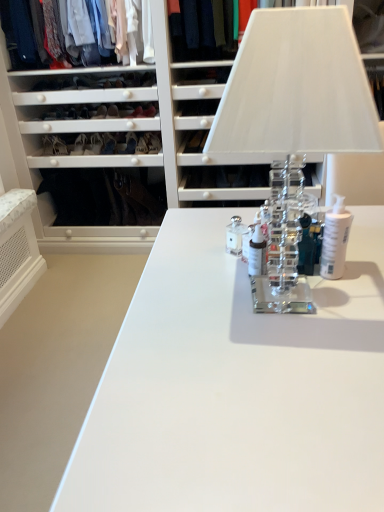
Question: Looking at the image, does matte black shoe at lower left, arranged as the third shoe when viewed from the right, seem bigger or smaller compared to matte white shirts at upper left, acting as the 2th clothing starting from the right?

Choices:
 (A) small
 (B) big

Answer: (A)

Question: Considering the positions of matte black shoe at lower left, arranged as the third shoe when viewed from the right, and matte white shirts at upper left, acting as the 2th clothing starting from the right, in the image, is matte black shoe at lower left, arranged as the third shoe when viewed from the right, wider or thinner than matte white shirts at upper left, acting as the 2th clothing starting from the right,?

Choices:
 (A) thin
 (B) wide

Answer: (A)

Question: Which is farther from the clear glass table lamp at center?

Choices:
 (A) white plastic pump bottle at center, the 3th toiletry from the left
 (B) matte white shirts at upper left, the 1th clothing viewed from the left
 (C) white glossy bottle at center, which ranks as the second toiletry in right-to-left order
 (D) matte black shoe at center, the 1th shoe positioned from the right
 (E) clear glass toiletry at center, the 3th toiletry in the right-to-left sequence

Answer: (D)

Question: Estimate the real-world distances between objects in this image. Which object is farther from the matte white shirts at upper left, acting as the 2th clothing starting from the right?

Choices:
 (A) white plastic pump bottle at center, the 3th toiletry from the left
 (B) white glossy bottle at center, which ranks as the second toiletry in right-to-left order
 (C) clear glass toiletry at center, the 3th toiletry in the right-to-left sequence
 (D) matte black shoe at center, positioned as the third shoe in left-to-right order
 (E) dark blue fabric at upper center, the first clothing positioned from the right

Answer: (A)